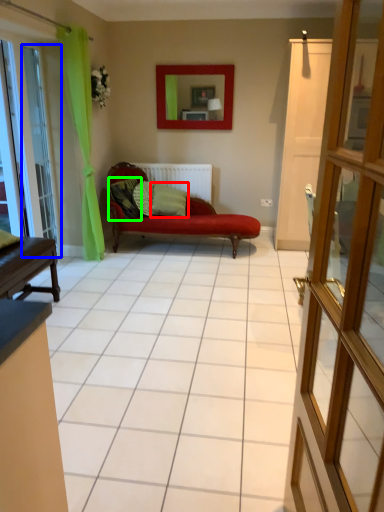
Question: Estimate the real-world distances between objects in this image. Which object is farther from pillow (highlighted by a red box), glass door (highlighted by a blue box) or pillow (highlighted by a green box)?

Choices:
 (A) glass door
 (B) pillow

Answer: (A)